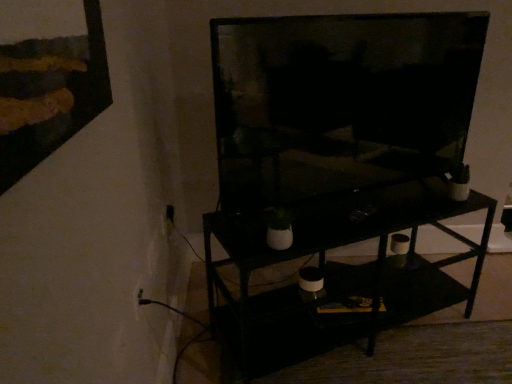
Question: Is point (139, 299) closer or farther from the camera than point (263, 360)?

Choices:
 (A) closer
 (B) farther

Answer: (A)

Question: Is white plastic electric outlet at lower left inside or outside of black matte shelf at center?

Choices:
 (A) inside
 (B) outside

Answer: (B)

Question: Which object is positioned closest to the matte black tv at center?

Choices:
 (A) black matte shelf at center
 (B) white plastic electric outlet at lower left

Answer: (A)

Question: Estimate the real-world distances between objects in this image. Which object is closer to the black matte shelf at center?

Choices:
 (A) white plastic electric outlet at lower left
 (B) matte black tv at center

Answer: (B)